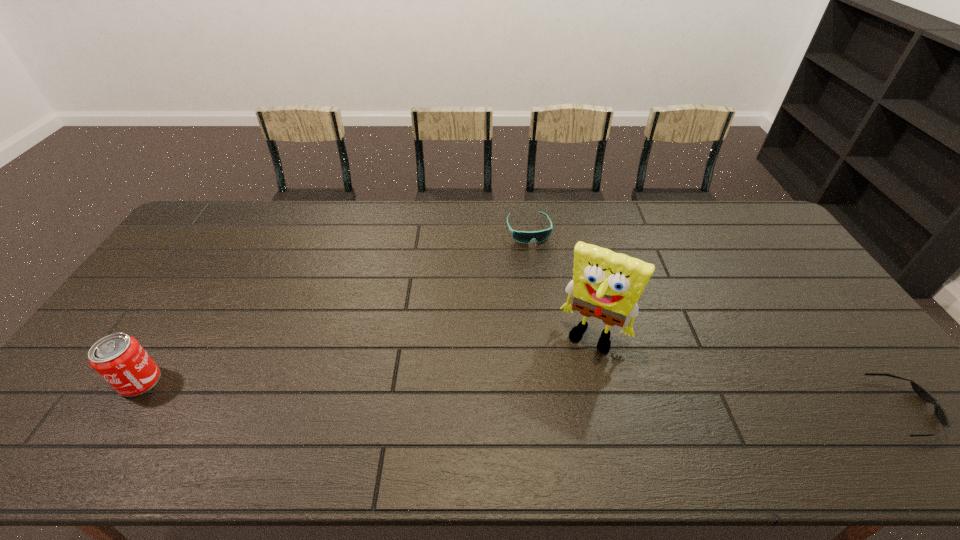
I want to click on object at the near left corner, so click(119, 359).

At what (x,y) coordinates should I click in order to perform the action: click on object present at the near right corner. Please return your answer as a coordinate pair (x, y). Looking at the image, I should click on (939, 412).

This screenshot has width=960, height=540. Identify the location of free space at the far edge. (523, 202).

At what (x,y) coordinates should I click in order to perform the action: click on vacant area at the near edge of the desktop. Please return your answer as a coordinate pair (x, y). The image size is (960, 540). Looking at the image, I should click on (240, 409).

Identify the location of vacant space at the right edge of the desktop. The image size is (960, 540). (819, 367).

The image size is (960, 540). Identify the location of vacant space at the far left corner. (231, 232).

Locate an element on the screen. This screenshot has width=960, height=540. vacant space that's between the third shortest object and the left sunglasses is located at coordinates (334, 306).

Find the location of a particular element. This screenshot has width=960, height=540. vacant region between the shortest object and the second farthest object is located at coordinates (750, 372).

Identify the location of vacant area that lies between the sponge and the can. (367, 359).

The width and height of the screenshot is (960, 540). Identify the location of free point between the taller sunglasses and the third shortest object. (334, 306).